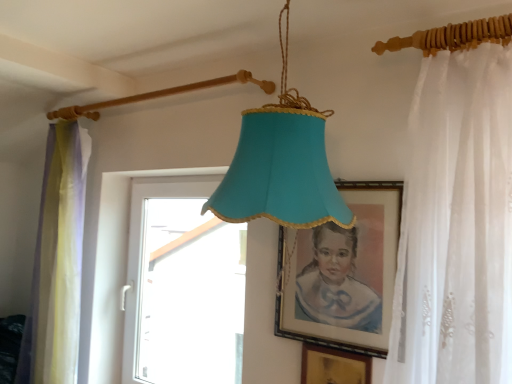
Question: Is matte gold picture frame at center, which ranks as the second picture frame in bottom-to-top order, wider than white plastic window at center?

Choices:
 (A) yes
 (B) no

Answer: (B)

Question: Is matte gold picture frame at center, the 1th picture frame when ordered from top to bottom, turned away from white plastic window at center?

Choices:
 (A) yes
 (B) no

Answer: (B)

Question: Considering the relative positions of matte gold picture frame at center, the 1th picture frame when ordered from top to bottom, and white plastic window at center in the image provided, is matte gold picture frame at center, the 1th picture frame when ordered from top to bottom, to the left of white plastic window at center from the viewer's perspective?

Choices:
 (A) yes
 (B) no

Answer: (B)

Question: Is white plastic window at center located within matte gold picture frame at center, the 1th picture frame when ordered from top to bottom?

Choices:
 (A) no
 (B) yes

Answer: (A)

Question: Does matte gold picture frame at center, the 1th picture frame when ordered from top to bottom, appear on the right side of white plastic window at center?

Choices:
 (A) yes
 (B) no

Answer: (A)

Question: From the image's perspective, does matte gold picture frame at center, the 1th picture frame when ordered from top to bottom, appear lower than white plastic window at center?

Choices:
 (A) yes
 (B) no

Answer: (B)

Question: Is white plastic window at center to the right of white sheer curtain at right, marked as the second curtain in a left-to-right arrangement, from the viewer's perspective?

Choices:
 (A) no
 (B) yes

Answer: (A)

Question: Can you confirm if white plastic window at center is shorter than white sheer curtain at right, the first curtain viewed from the right?

Choices:
 (A) yes
 (B) no

Answer: (B)

Question: Is white plastic window at center wider than white sheer curtain at right, which appears as the 1th curtain when viewed from the front?

Choices:
 (A) no
 (B) yes

Answer: (A)

Question: Is white plastic window at center further to the viewer compared to white sheer curtain at right, the first curtain viewed from the right?

Choices:
 (A) yes
 (B) no

Answer: (A)

Question: Considering the relative positions of white plastic window at center and white sheer curtain at right, marked as the second curtain in a back-to-front arrangement, in the image provided, is white plastic window at center to the left of white sheer curtain at right, marked as the second curtain in a back-to-front arrangement, from the viewer's perspective?

Choices:
 (A) no
 (B) yes

Answer: (B)

Question: From a real-world perspective, is white plastic window at center under white sheer curtain at right, marked as the second curtain in a back-to-front arrangement?

Choices:
 (A) yes
 (B) no

Answer: (A)

Question: From a real-world perspective, is white sheer curtain at right, marked as the second curtain in a left-to-right arrangement, physically below gold metallic picture frame at lower center, the 1th picture frame ordered from the bottom?

Choices:
 (A) no
 (B) yes

Answer: (A)